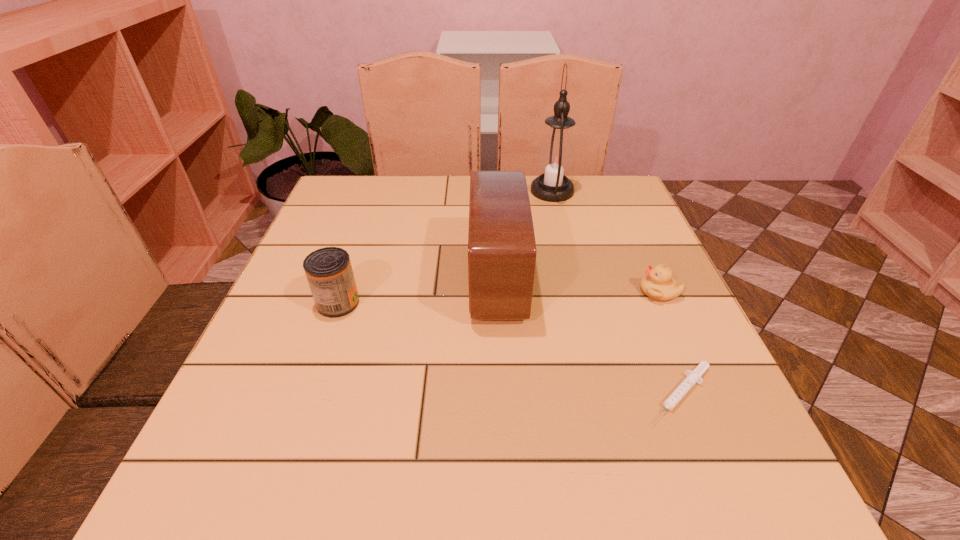
This screenshot has height=540, width=960. What are the coordinates of `vacant area between the radio receiver and the second shortest object` in the screenshot? It's located at (578, 285).

You are a GUI agent. You are given a task and a screenshot of the screen. Output one action in this format:
    pyautogui.click(x=<x>, y=<y>)
    Task: Click on the free area in between the radio receiver and the duckling
    
    Given the screenshot: What is the action you would take?
    pyautogui.click(x=578, y=285)

Locate an element on the screen. The height and width of the screenshot is (540, 960). free spot between the tallest object and the nearest object is located at coordinates (615, 293).

I want to click on vacant area that lies between the shortest object and the leftmost object, so click(x=509, y=348).

Identify the location of free space between the second shortest object and the second tallest object. Image resolution: width=960 pixels, height=540 pixels. (578, 285).

Locate an element on the screen. Image resolution: width=960 pixels, height=540 pixels. unoccupied area between the can and the fourth shortest object is located at coordinates (418, 291).

You are a GUI agent. You are given a task and a screenshot of the screen. Output one action in this format:
    pyautogui.click(x=<x>, y=<y>)
    Task: Click on the empty location between the third tallest object and the nearest object
    
    Given the screenshot: What is the action you would take?
    pyautogui.click(x=509, y=348)

Locate which object ranks fourth in proximity to the fourth object from right to left. Please provide its 2D coordinates. Your answer should be formatted as a tuple, i.e. [(x, y)], where the tuple contains the x and y coordinates of a point satisfying the conditions above.

[(658, 284)]

Where is `object that is the fourth closest to the can`? This screenshot has height=540, width=960. object that is the fourth closest to the can is located at coordinates (658, 284).

Find the location of `vacant region that satisfies the following two spatial constraints: 1. on the back side of the oil lamp; 2. on the left side of the leftmost object`. vacant region that satisfies the following two spatial constraints: 1. on the back side of the oil lamp; 2. on the left side of the leftmost object is located at coordinates (377, 191).